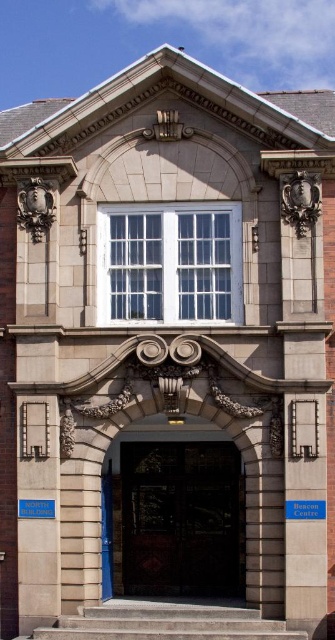
Question: Is dark wood door at center positioned behind concrete stairs at center?

Choices:
 (A) yes
 (B) no

Answer: (A)

Question: Is dark wood door at center positioned behind concrete stairs at center?

Choices:
 (A) yes
 (B) no

Answer: (A)

Question: Is dark wood door at center above concrete stairs at center?

Choices:
 (A) yes
 (B) no

Answer: (A)

Question: Which of the following is the farthest from the observer?

Choices:
 (A) dark wood door at center
 (B) concrete stairs at center

Answer: (A)

Question: Which point is closer to the camera?

Choices:
 (A) pos(168,611)
 (B) pos(148,465)

Answer: (A)